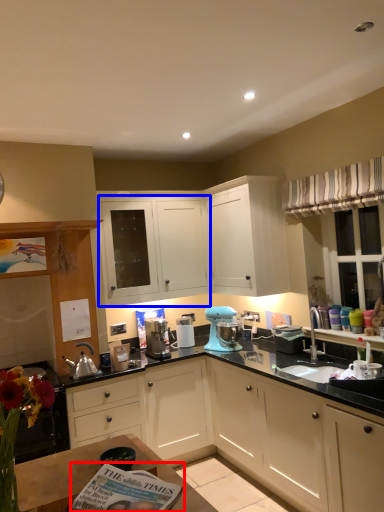
Question: Which object appears farthest to the camera in this image, magazine (highlighted by a red box) or cabinetry (highlighted by a blue box)?

Choices:
 (A) magazine
 (B) cabinetry

Answer: (B)